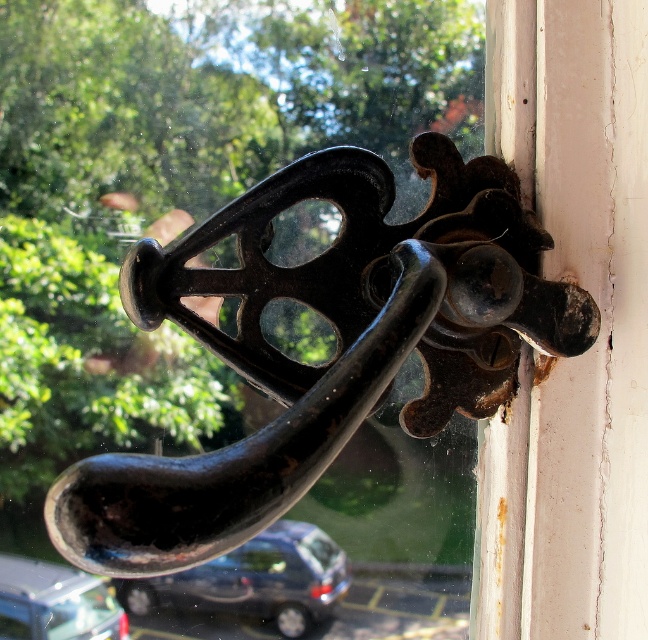
Question: Estimate the real-world distances between objects in this image. Which object is farther from the black cast iron handle at center?

Choices:
 (A) metallic silver car at lower left
 (B) shiny metallic car at lower center

Answer: (A)

Question: Can you confirm if black cast iron handle at center is thinner than shiny metallic car at lower center?

Choices:
 (A) no
 (B) yes

Answer: (A)

Question: Is shiny metallic car at lower center closer to the viewer compared to metallic silver car at lower left?

Choices:
 (A) yes
 (B) no

Answer: (B)

Question: Which object is the farthest from the black cast iron handle at center?

Choices:
 (A) shiny metallic car at lower center
 (B) metallic silver car at lower left

Answer: (B)

Question: Which point is closer to the camera?

Choices:
 (A) (367, 182)
 (B) (275, 596)
 (C) (87, 602)

Answer: (C)

Question: Can you confirm if shiny metallic car at lower center is thinner than metallic silver car at lower left?

Choices:
 (A) yes
 (B) no

Answer: (B)